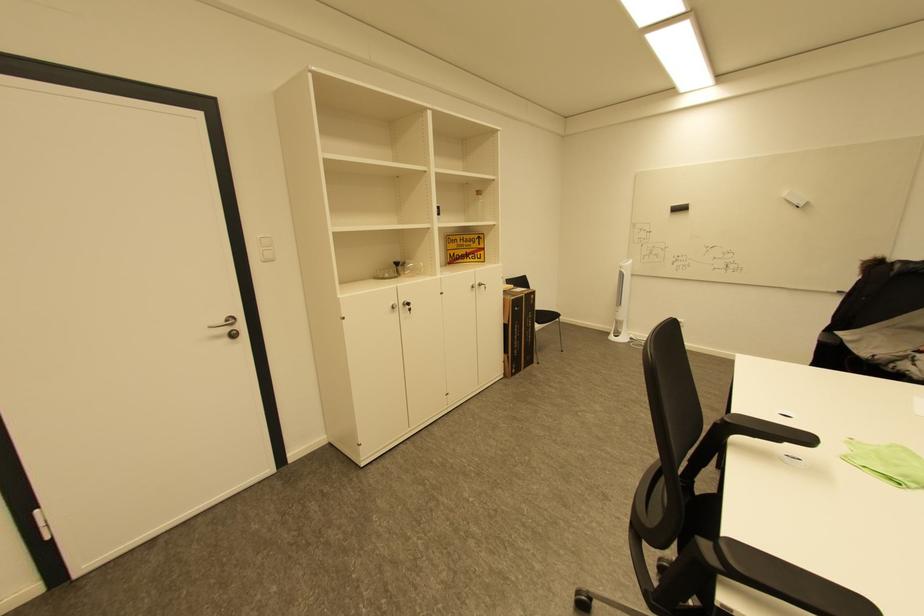
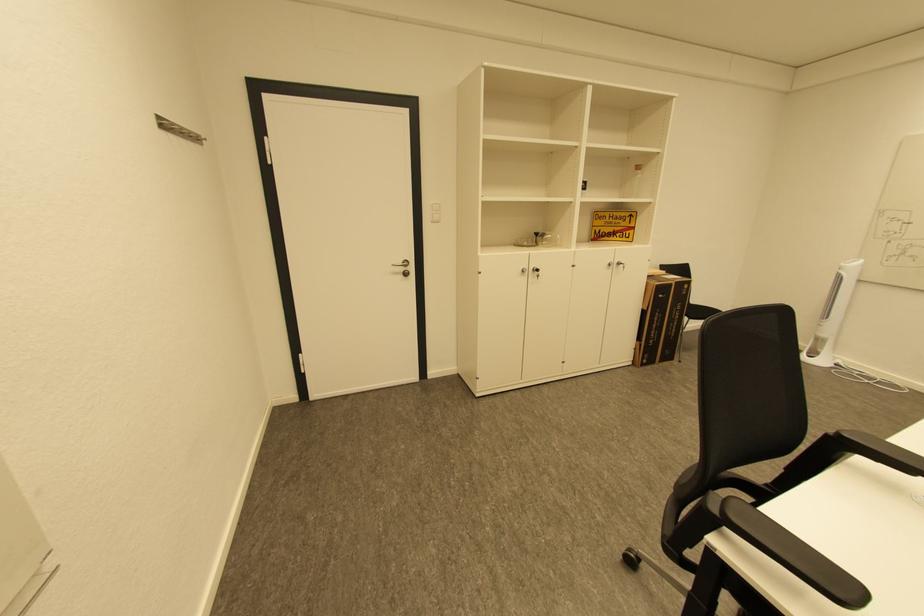
The point at (x=233, y=330) is marked in the first image. Where is the corresponding point in the second image?

(408, 270)